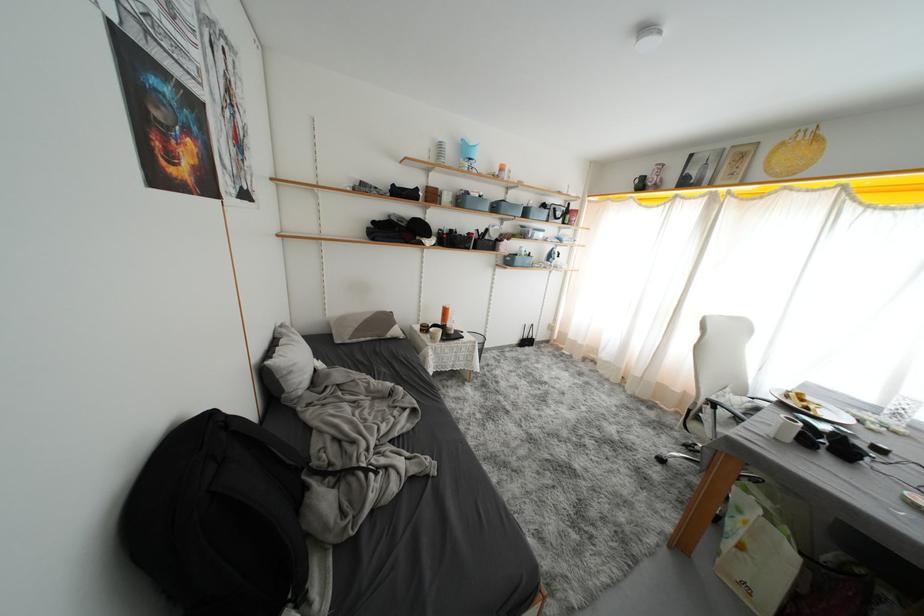
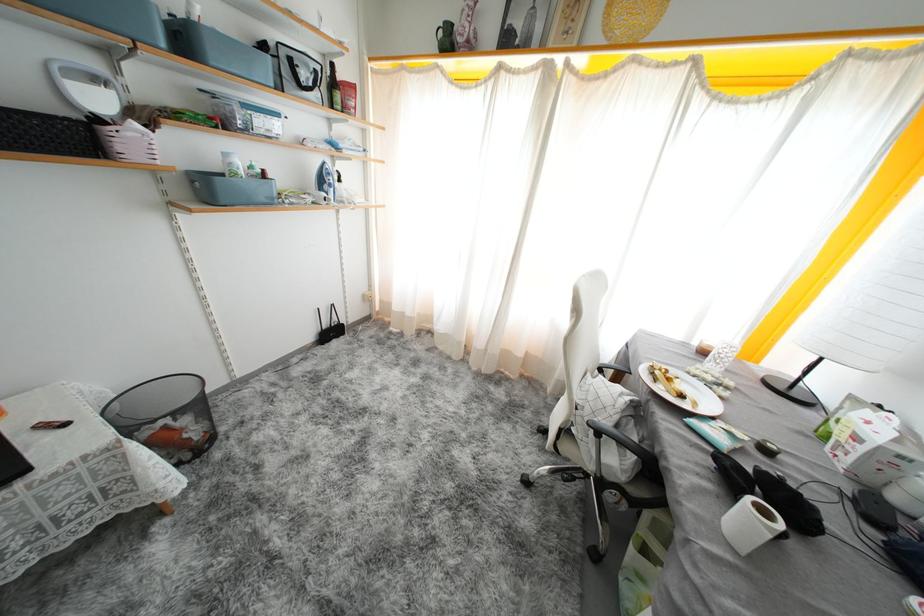
Where in the second image is the point corresponding to [500,230] from the first image?

(103, 84)